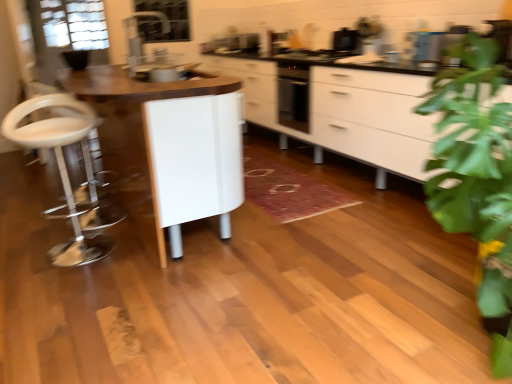
Identify the location of free space in front of white glossy table at center. (162, 293).